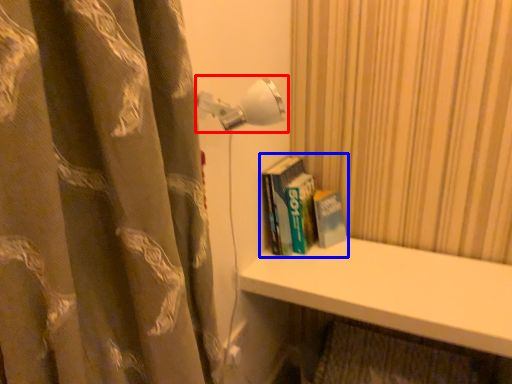
Question: Which of the following is the farthest to the observer, lamp (highlighted by a red box) or book (highlighted by a blue box)?

Choices:
 (A) lamp
 (B) book

Answer: (B)